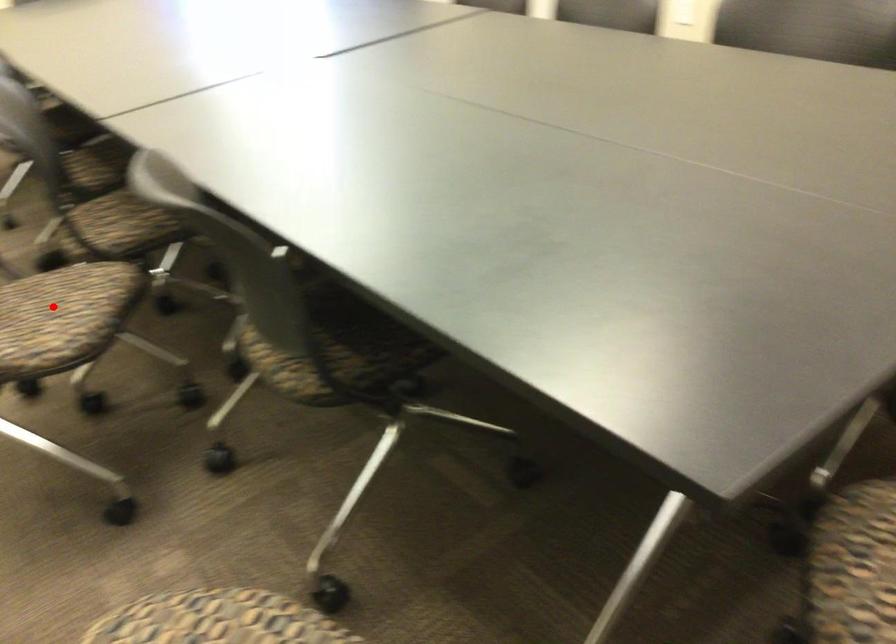
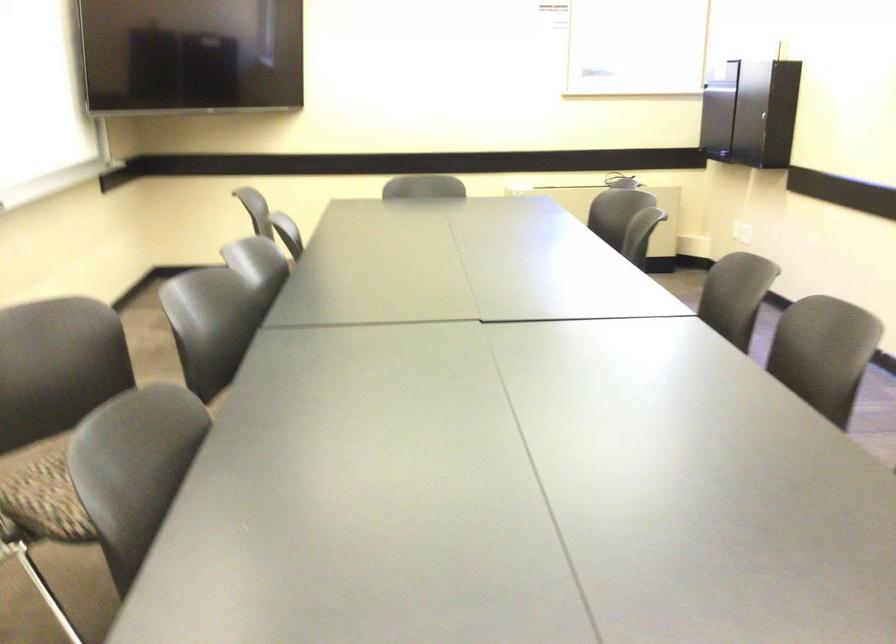
Question: I am providing you with two images of the same scene from different viewpoints. A red point is marked on the first image. Can you still see the location of the red point in image 2?

Choices:
 (A) Yes
 (B) No

Answer: (B)